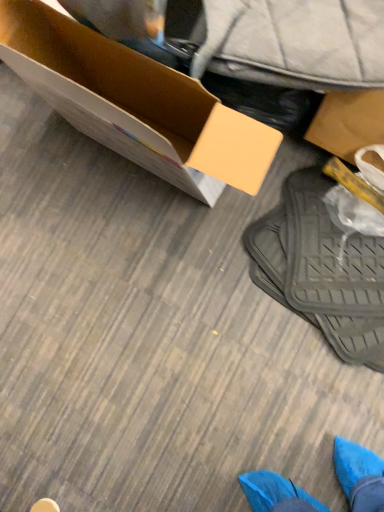
Question: Is blue suede shoe at lower left located within black rubber mat at lower right?

Choices:
 (A) no
 (B) yes

Answer: (A)

Question: From a real-world perspective, is black rubber mat at lower right located beneath blue suede shoe at lower left?

Choices:
 (A) yes
 (B) no

Answer: (B)

Question: From the image's perspective, does black rubber mat at lower right appear lower than blue suede shoe at lower left?

Choices:
 (A) no
 (B) yes

Answer: (A)

Question: Is black rubber mat at lower right thinner than blue suede shoe at lower left?

Choices:
 (A) no
 (B) yes

Answer: (A)

Question: Considering the relative positions of black rubber mat at lower right and blue suede shoe at lower left in the image provided, is black rubber mat at lower right to the right of blue suede shoe at lower left from the viewer's perspective?

Choices:
 (A) yes
 (B) no

Answer: (A)

Question: Is black rubber mat at lower right positioned behind blue suede shoe at lower left?

Choices:
 (A) yes
 (B) no

Answer: (B)

Question: From the image's perspective, is blue suede shoe at lower left above cardboard box at upper left?

Choices:
 (A) no
 (B) yes

Answer: (A)

Question: Is cardboard box at upper left surrounded by blue suede shoe at lower left?

Choices:
 (A) no
 (B) yes

Answer: (A)

Question: Is blue suede shoe at lower left to the left of cardboard box at upper left from the viewer's perspective?

Choices:
 (A) yes
 (B) no

Answer: (A)

Question: From a real-world perspective, is blue suede shoe at lower left beneath cardboard box at upper left?

Choices:
 (A) no
 (B) yes

Answer: (B)

Question: Is blue suede shoe at lower left wider than cardboard box at upper left?

Choices:
 (A) no
 (B) yes

Answer: (A)

Question: Considering the relative sizes of blue suede shoe at lower left and cardboard box at upper left in the image provided, is blue suede shoe at lower left bigger than cardboard box at upper left?

Choices:
 (A) yes
 (B) no

Answer: (B)

Question: From a real-world perspective, is blue suede shoe at lower left physically above black rubber mat at lower right?

Choices:
 (A) no
 (B) yes

Answer: (A)